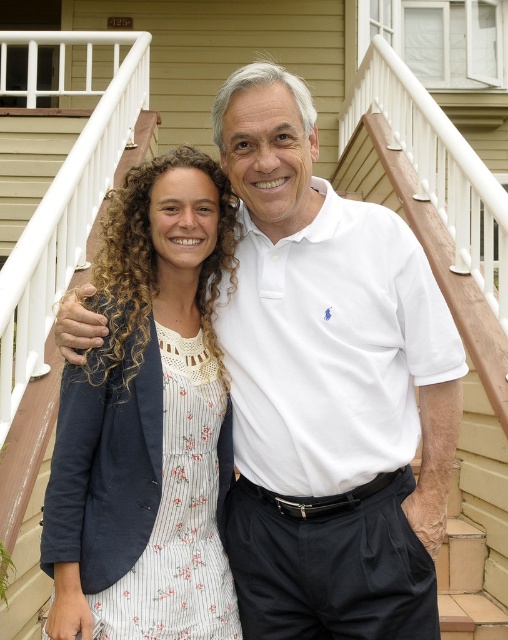
You are a photographer setting up for a family portrait. You need to ensure that the white floral dress at center is visible above the wooden at center in the final shot. Based on their heights, will this be possible?

The white floral dress at center is shorter than the wooden at center, so it will not be visible above it in the final shot.

Looking at this image, you are a photographer taking a picture of the scene. You need to ensure the white floral dress at center and the wooden at center are positioned correctly. According to the scene description, which object is on the left side of the other?

The white floral dress at center is to the left of wooden at center.

Based on the coordinates provided, can you identify which object corresponds to the point labeled as point (329,387)?

The point (329,387) corresponds to the white cotton polo shirt at center.